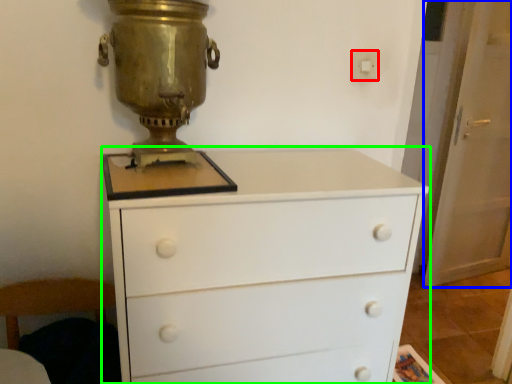
Question: Which object is positioned farthest from electric outlet (highlighted by a red box)? Select from screen door (highlighted by a blue box) and chest of drawers (highlighted by a green box).

Choices:
 (A) screen door
 (B) chest of drawers

Answer: (A)